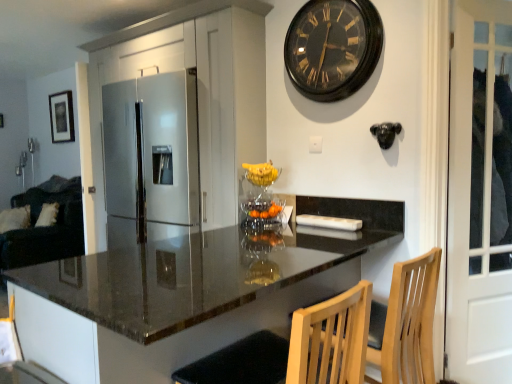
Question: Does black wooden clock at upper center have a lesser height compared to white glass door at right?

Choices:
 (A) no
 (B) yes

Answer: (B)

Question: Is there a large distance between black wooden clock at upper center and white glass door at right?

Choices:
 (A) yes
 (B) no

Answer: (B)

Question: Considering the relative sizes of black wooden clock at upper center and white glass door at right in the image provided, is black wooden clock at upper center bigger than white glass door at right?

Choices:
 (A) no
 (B) yes

Answer: (A)

Question: Is white glass door at right at the back of black wooden clock at upper center?

Choices:
 (A) yes
 (B) no

Answer: (B)

Question: Does black wooden clock at upper center have a lesser width compared to white glass door at right?

Choices:
 (A) no
 (B) yes

Answer: (B)

Question: In terms of width, does black wooden clock at upper center look wider or thinner when compared to satin silver refrigerator at center?

Choices:
 (A) wide
 (B) thin

Answer: (B)

Question: Is point (287, 52) positioned closer to the camera than point (151, 69)?

Choices:
 (A) farther
 (B) closer

Answer: (B)

Question: Considering their positions, is black wooden clock at upper center located in front of or behind satin silver refrigerator at center?

Choices:
 (A) front
 (B) behind

Answer: (A)

Question: Is black wooden clock at upper center bigger or smaller than satin silver refrigerator at center?

Choices:
 (A) big
 (B) small

Answer: (B)

Question: From a real-world perspective, is black matte picture frame at upper left positioned above or below white glass door at right?

Choices:
 (A) below
 (B) above

Answer: (B)

Question: Visually, is black matte picture frame at upper left positioned to the left or to the right of white glass door at right?

Choices:
 (A) right
 (B) left

Answer: (B)

Question: From the image's perspective, is black matte picture frame at upper left above or below white glass door at right?

Choices:
 (A) above
 (B) below

Answer: (A)

Question: Is black matte picture frame at upper left taller or shorter than white glass door at right?

Choices:
 (A) short
 (B) tall

Answer: (A)

Question: From a real-world perspective, is white glass door at right physically located above or below satin silver refrigerator at center?

Choices:
 (A) below
 (B) above

Answer: (A)

Question: Considering the positions of white glass door at right and satin silver refrigerator at center in the image, is white glass door at right wider or thinner than satin silver refrigerator at center?

Choices:
 (A) wide
 (B) thin

Answer: (B)